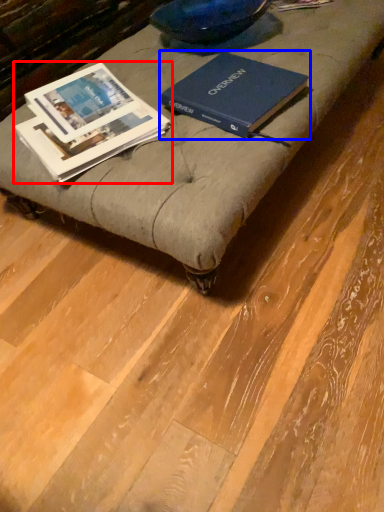
Question: Which object appears closest to the camera in this image, book (highlighted by a red box) or book (highlighted by a blue box)?

Choices:
 (A) book
 (B) book

Answer: (A)